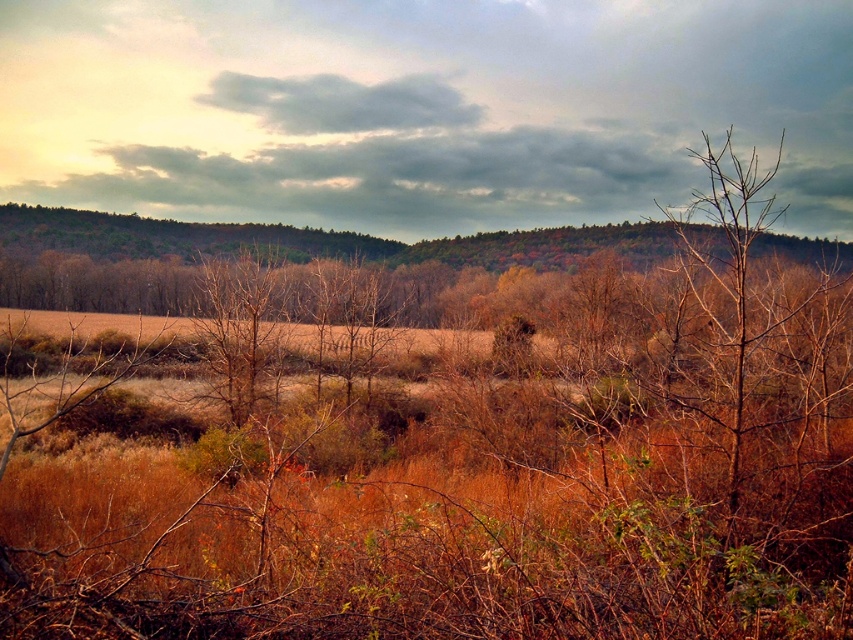
Question: Which point appears closest to the camera in this image?

Choices:
 (A) (746, 227)
 (B) (242, 342)

Answer: (A)

Question: Can you confirm if bare branches at right is wider than brown dry tree at center?

Choices:
 (A) yes
 (B) no

Answer: (A)

Question: Does bare branches at right have a lesser width compared to brown dry tree at center?

Choices:
 (A) no
 (B) yes

Answer: (A)

Question: Can you confirm if bare branches at right is positioned to the right of brown dry tree at center?

Choices:
 (A) no
 (B) yes

Answer: (B)

Question: Which of the following is the farthest from the observer?

Choices:
 (A) brown dry tree at center
 (B) bare branches at right

Answer: (A)